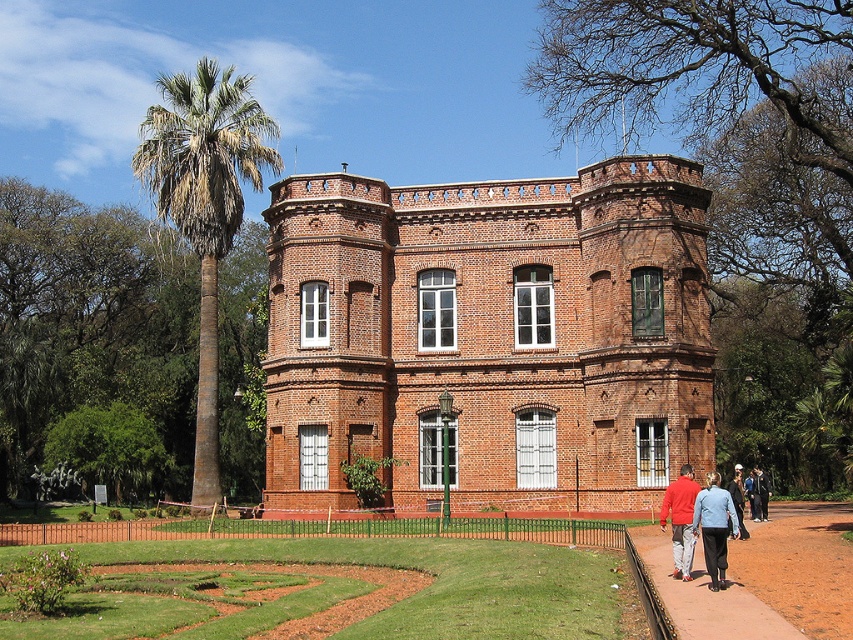
Question: Which object is farther from the camera taking this photo?

Choices:
 (A) brick building at center
 (B) blue denim jacket at lower right
 (C) brown dirt path at lower right
 (D) green leafy palm at left

Answer: (D)

Question: Does brick building at center appear over brown dirt path at lower right?

Choices:
 (A) yes
 (B) no

Answer: (A)

Question: Can you confirm if brown dirt path at lower right is positioned to the left of red jacket at lower right?

Choices:
 (A) no
 (B) yes

Answer: (A)

Question: Which object appears closest to the camera in this image?

Choices:
 (A) dark blue jeans at lower right
 (B) red jacket at lower right
 (C) blue denim jacket at lower right

Answer: (C)

Question: Estimate the real-world distances between objects in this image. Which object is farther from the blue denim jacket at center?

Choices:
 (A) red jacket at lower right
 (B) brown dirt path at lower right
 (C) blue denim jacket at lower right
 (D) dark blue jeans at lower right

Answer: (C)

Question: Can you confirm if blue denim jacket at lower right is wider than red jacket at lower right?

Choices:
 (A) no
 (B) yes

Answer: (B)